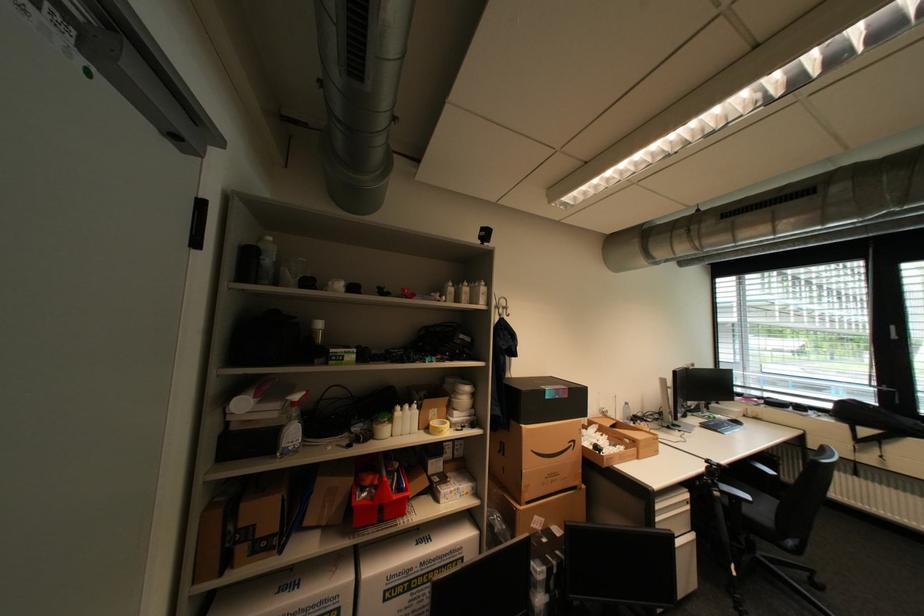
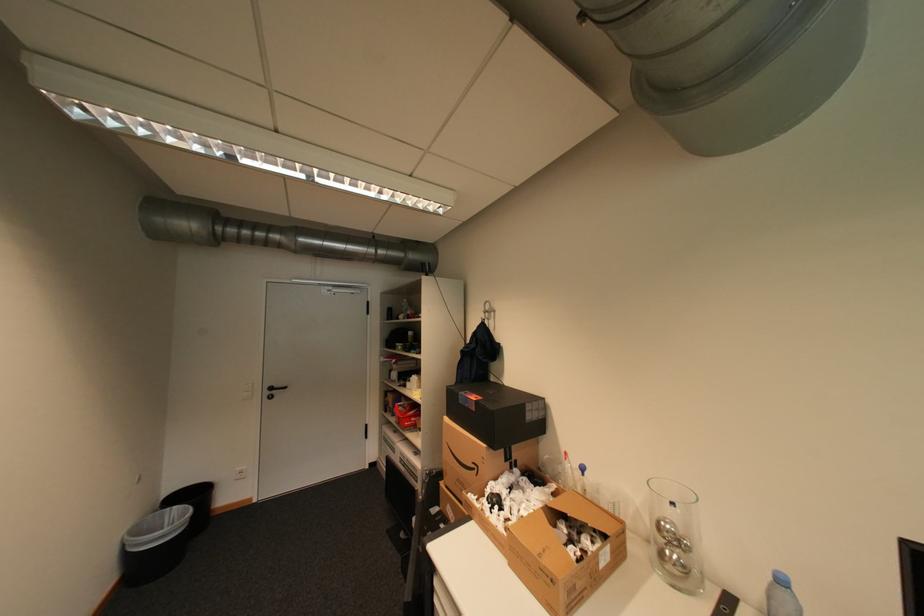
The point at (565, 397) is marked in the first image. Where is the corresponding point in the second image?

(476, 406)